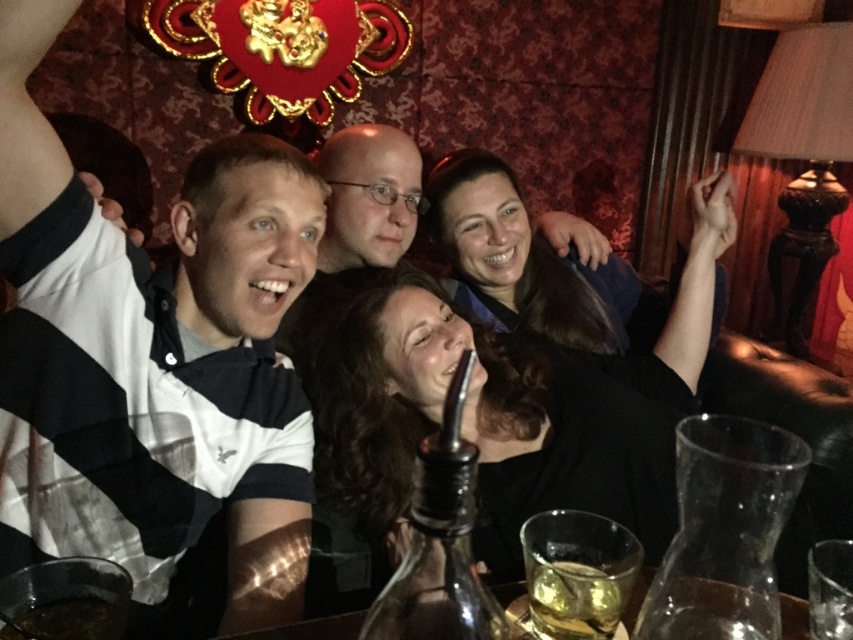
You are a bartender who needs to pour the brown liquid at lower left into the translucent glass at center. Based on their heights, will the liquid overflow when filled to the top?

The translucent glass at center has a greater height compared to brown liquid at lower left, so pouring the brown liquid at lower left into the translucent glass at center will not cause overflow as the glass is taller than the liquid level.

You are a waiter trying to place a new drink order on the table. The table has a translucent glass at center. Where should you place the drink to avoid the existing item at point (573, 600)?

Place the drink away from point (573, 600) since that point is on the translucent glass at center, which is already occupied by an item.